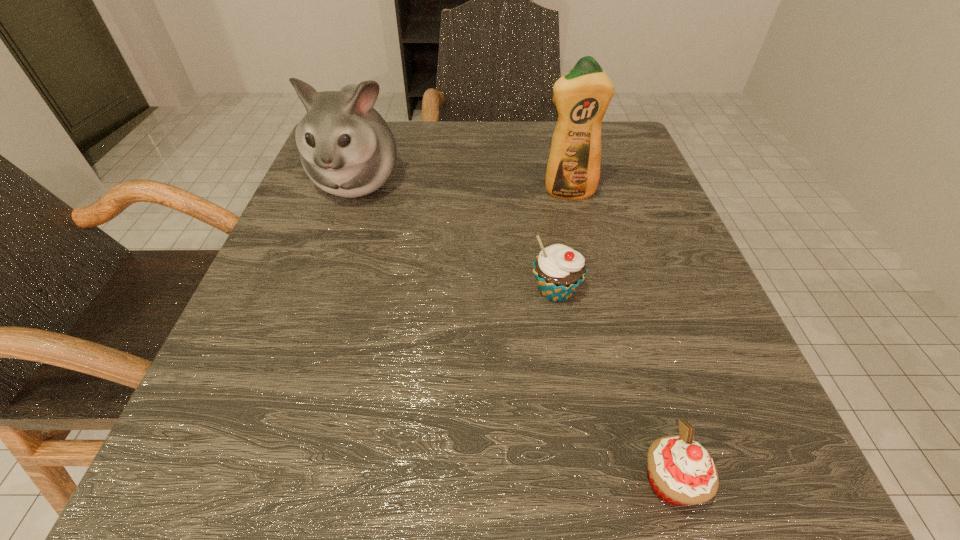
Image resolution: width=960 pixels, height=540 pixels. I want to click on vacant space located 0.070m on the back of the nearer cupcake, so click(x=645, y=394).

I want to click on object present at the far edge, so click(347, 149).

This screenshot has width=960, height=540. I want to click on object that is at the near edge, so click(x=681, y=472).

Identify the location of object present at the left edge. The width and height of the screenshot is (960, 540). (347, 149).

Locate an element on the screen. detergent that is at the right edge is located at coordinates (582, 96).

The image size is (960, 540). I want to click on cupcake situated at the right edge, so click(681, 472).

You are a GUI agent. You are given a task and a screenshot of the screen. Output one action in this format:
    pyautogui.click(x=<x>, y=<y>)
    Task: Click on the object situated at the far left corner
    The height and width of the screenshot is (540, 960).
    Given the screenshot: What is the action you would take?
    pyautogui.click(x=347, y=149)

Locate an element on the screen. object located at the near right corner is located at coordinates tap(681, 472).

Locate an element on the screen. This screenshot has width=960, height=540. vacant space at the far edge of the desktop is located at coordinates (485, 161).

Find the location of `vacant space at the near edge of the desktop`. vacant space at the near edge of the desktop is located at coordinates (508, 453).